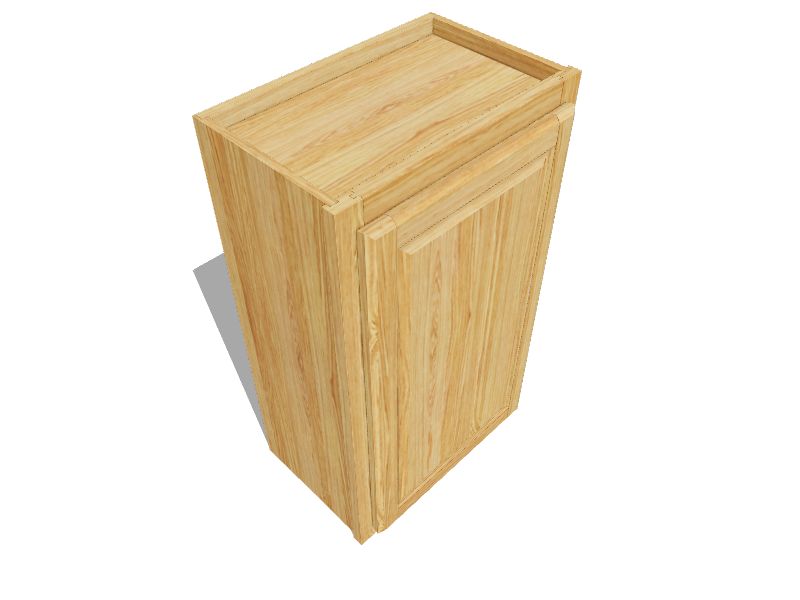
The image size is (800, 600). In order to click on empty space behind the box in this screenshot , I will do `click(168, 192)`.